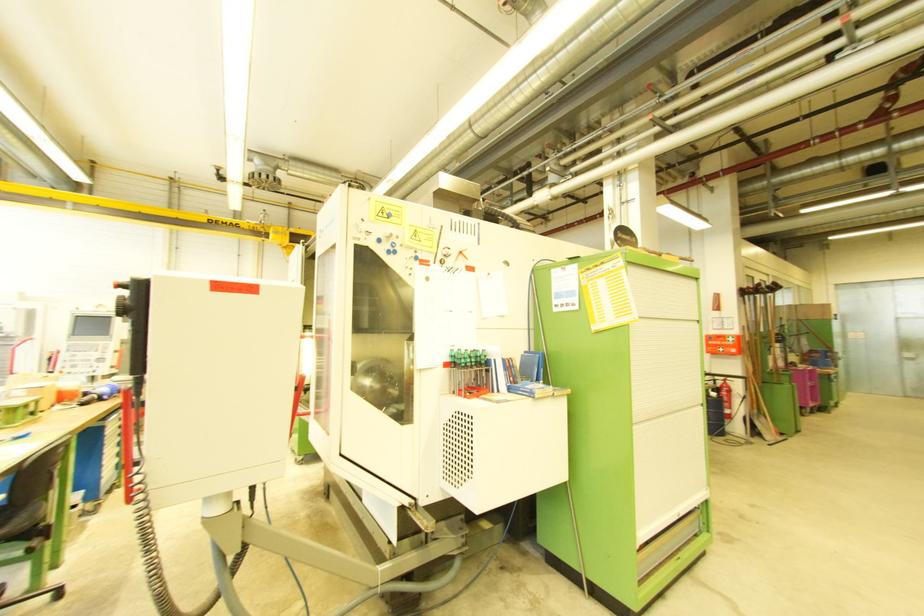
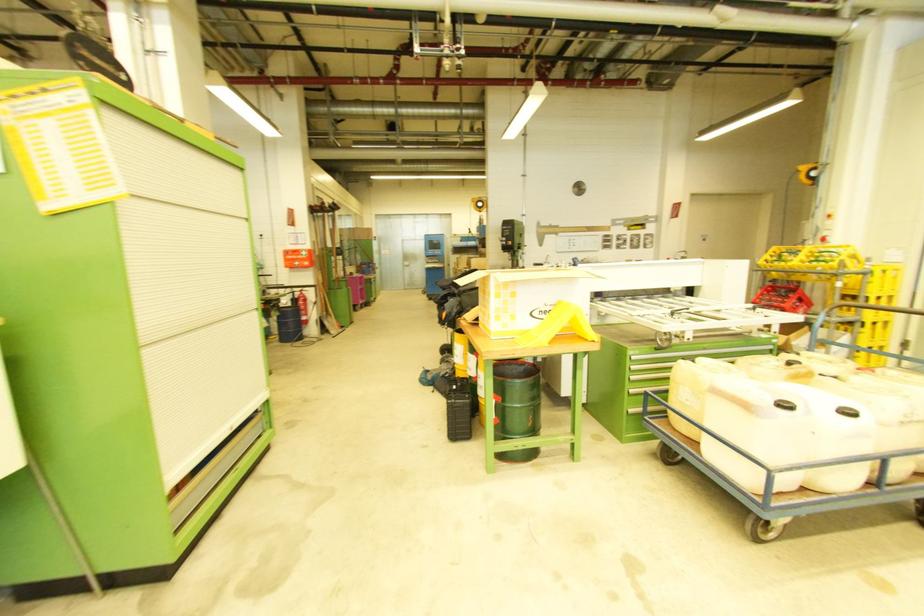
Find the pixel in the second image that matches point 723,352 in the first image.

(299, 265)